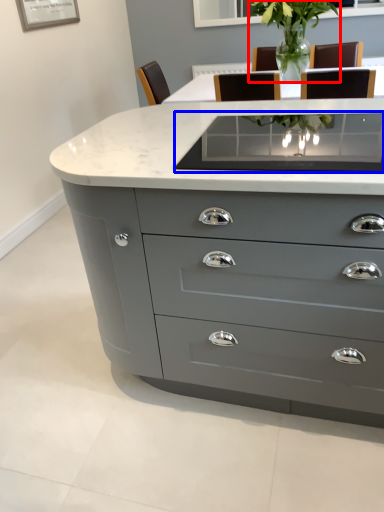
Question: Which of the following is the farthest to the observer, plant (highlighted by a red box) or glass table (highlighted by a blue box)?

Choices:
 (A) plant
 (B) glass table

Answer: (A)